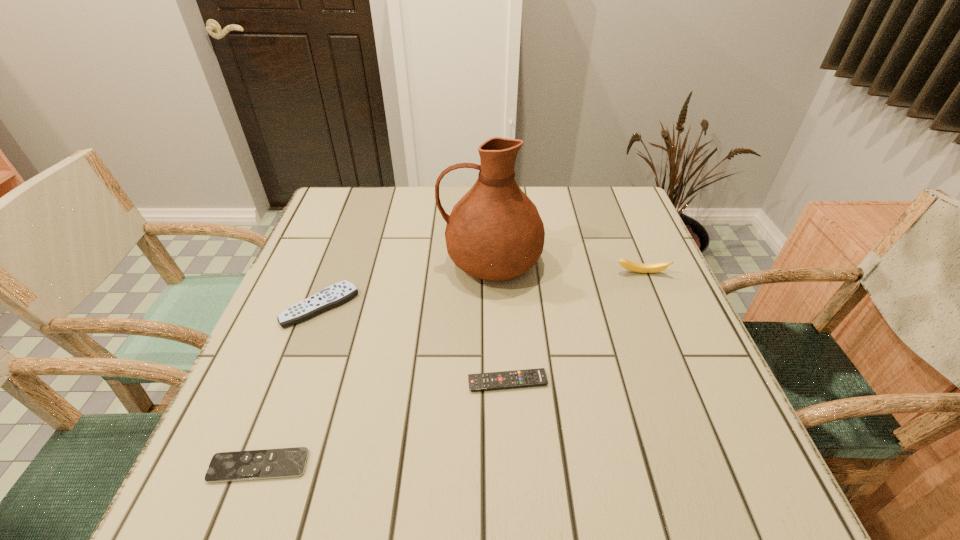
At what (x,y) coordinates should I click in order to perform the action: click on vacant space at the near edge of the desktop. Please return your answer as a coordinate pair (x, y). Looking at the image, I should click on (483, 510).

This screenshot has width=960, height=540. In the image, there is a desktop. What are the coordinates of `vacant area at the left edge` in the screenshot? It's located at (282, 446).

You are a GUI agent. You are given a task and a screenshot of the screen. Output one action in this format:
    pyautogui.click(x=<x>, y=<y>)
    Task: Click on the vacant area at the right edge
    The width and height of the screenshot is (960, 540).
    Given the screenshot: What is the action you would take?
    pyautogui.click(x=658, y=285)

You are a GUI agent. You are given a task and a screenshot of the screen. Output one action in this format:
    pyautogui.click(x=<x>, y=<y>)
    Task: Click on the vacant region at the far left corner of the desktop
    Image resolution: width=960 pixels, height=540 pixels.
    Given the screenshot: What is the action you would take?
    377,218

The width and height of the screenshot is (960, 540). In the image, there is a desktop. Find the location of `vacant region at the far right corner`. vacant region at the far right corner is located at coordinates (625, 188).

At what (x,y) coordinates should I click in order to perform the action: click on vacant space that is in between the second nearest object and the rightmost object. Please return your answer as a coordinate pair (x, y). The height and width of the screenshot is (540, 960). Looking at the image, I should click on coord(574,327).

Where is `empty space between the tallest remote control and the second nearest object`? empty space between the tallest remote control and the second nearest object is located at coordinates (x=414, y=344).

Where is `vacant area between the shortest remote control and the fourth tallest object`? vacant area between the shortest remote control and the fourth tallest object is located at coordinates (383, 424).

Image resolution: width=960 pixels, height=540 pixels. I want to click on free spot between the farthest remote control and the tallest object, so 405,284.

The width and height of the screenshot is (960, 540). Identify the location of vacant region between the nearest remote control and the tallest object. tap(374, 363).